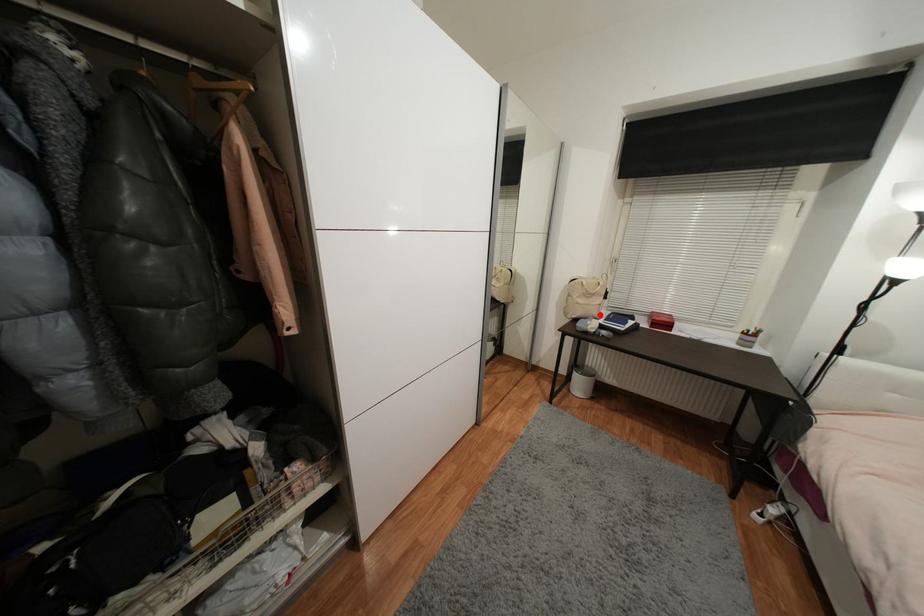
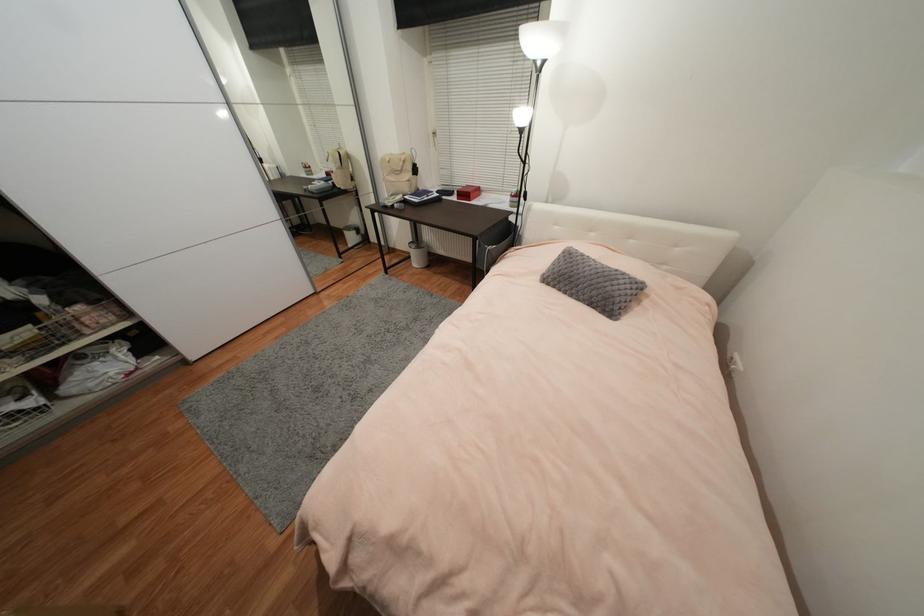
Question: I am providing you with two images of the same scene from different viewpoints. Image1 has a red point marked. In image2, the corresponding 3D location appears at what relative position? Reply with the corresponding letter.

Choices:
 (A) Closer
 (B) Farther

Answer: (A)